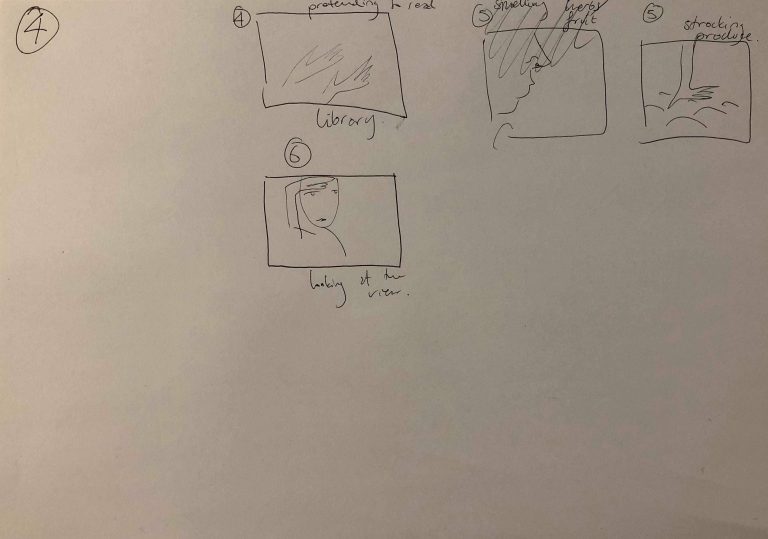
Where is `library`? The width and height of the screenshot is (768, 539). library is located at coordinates (328, 127), (353, 125).